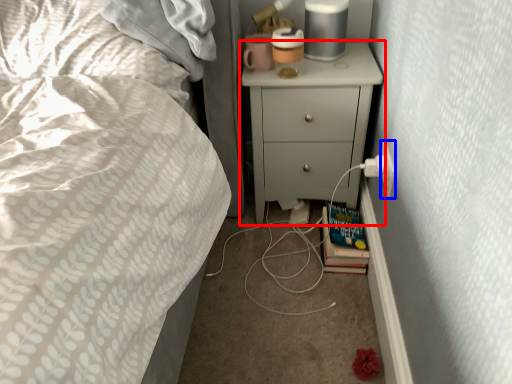
Question: Which point is closer to the camera, chest of drawers (highlighted by a red box) or electric outlet (highlighted by a blue box)?

Choices:
 (A) chest of drawers
 (B) electric outlet

Answer: (B)